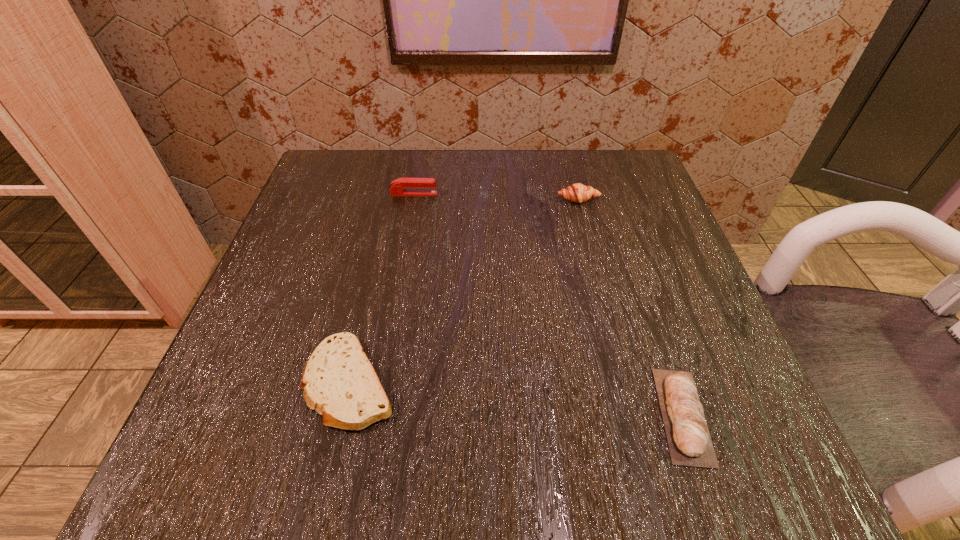
Locate an element on the screen. The image size is (960, 540). pastry that is at the far edge is located at coordinates (579, 193).

Locate an element on the screen. The image size is (960, 540). object that is at the left edge is located at coordinates (339, 382).

Identify the location of pastry that is positioned at the right edge. The height and width of the screenshot is (540, 960). (579, 193).

Locate an element on the screen. pita bread at the right edge is located at coordinates click(x=689, y=441).

The height and width of the screenshot is (540, 960). Find the location of `object present at the near left corner`. object present at the near left corner is located at coordinates (339, 382).

Image resolution: width=960 pixels, height=540 pixels. Identify the location of object that is at the far right corner. (579, 193).

Image resolution: width=960 pixels, height=540 pixels. Find the location of `object at the near right corner`. object at the near right corner is located at coordinates (689, 441).

Image resolution: width=960 pixels, height=540 pixels. Identify the location of blank area at the far edge. (486, 179).

At what (x,y) coordinates should I click in order to perform the action: click on vacant region at the near edge of the desktop. Please return your answer as a coordinate pair (x, y). Looking at the image, I should click on (378, 483).

You are a GUI agent. You are given a task and a screenshot of the screen. Output one action in this format:
    pyautogui.click(x=<x>, y=<y>)
    Task: Click on the vacant position at the left edge of the desktop
    The height and width of the screenshot is (540, 960).
    Given the screenshot: What is the action you would take?
    (x=256, y=307)